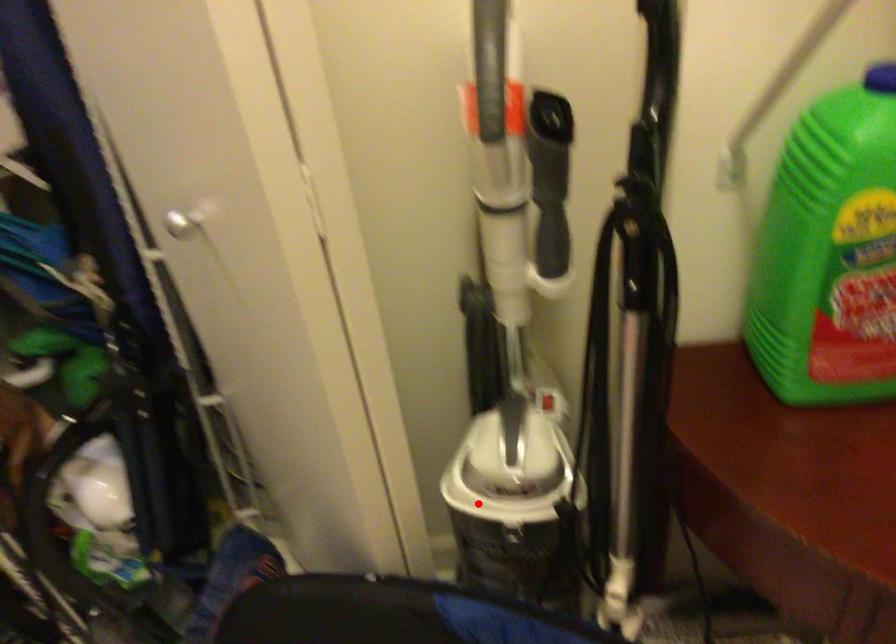
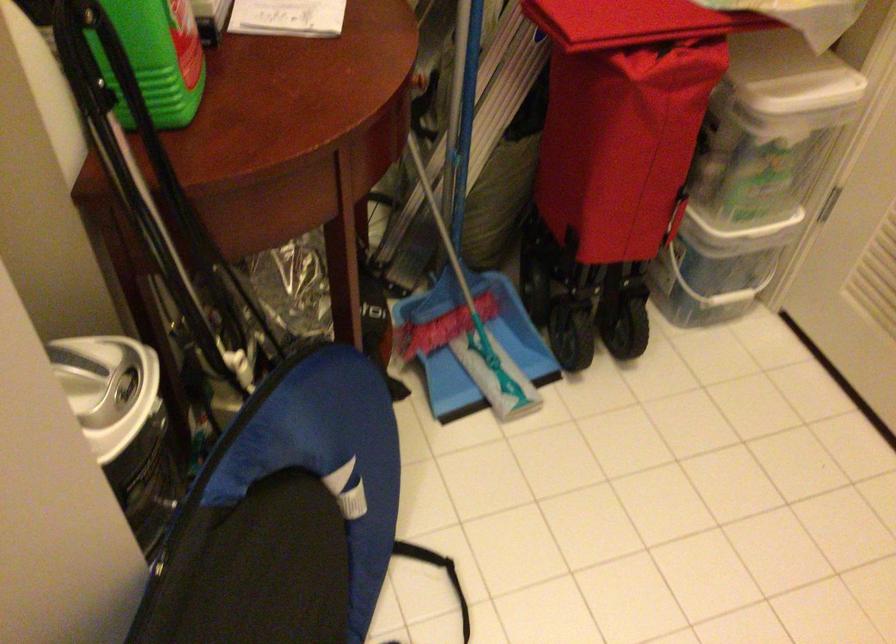
Where in the second image is the point corresponding to the highlighted location from the first image?

(123, 424)